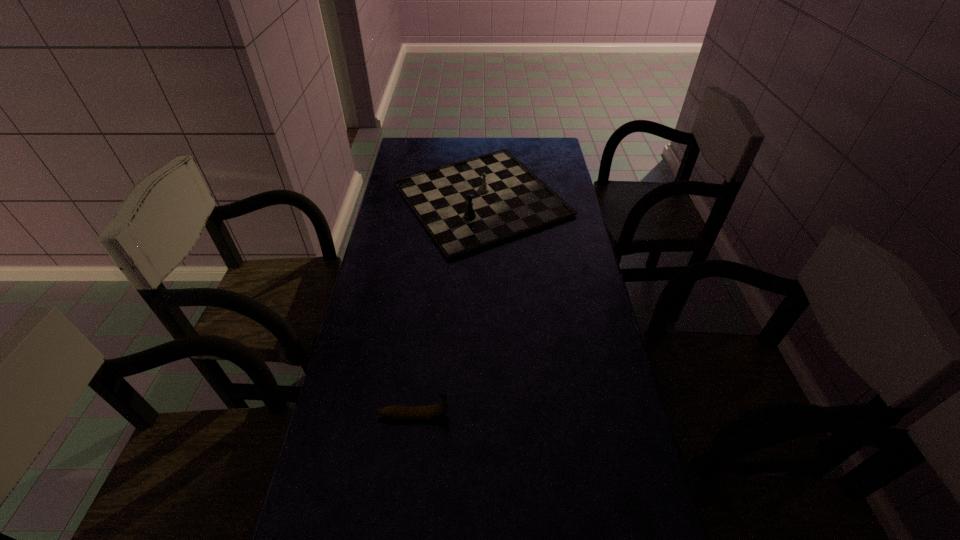
Locate an element on the screen. The height and width of the screenshot is (540, 960). the farther object is located at coordinates (467, 205).

Locate an element on the screen. The width and height of the screenshot is (960, 540). banana is located at coordinates (434, 411).

Locate an element on the screen. The width and height of the screenshot is (960, 540). vacant area situated 0.050m on the front of the farther object is located at coordinates (481, 271).

What are the coordinates of `free region located 0.400m at the stem of the nearer object` in the screenshot? It's located at (612, 415).

Find the location of a particular element. The height and width of the screenshot is (540, 960). object located at the far edge is located at coordinates (467, 205).

Image resolution: width=960 pixels, height=540 pixels. I want to click on gameboard that is at the left edge, so click(467, 205).

At what (x,y) coordinates should I click in order to perform the action: click on banana situated at the left edge. Please return your answer as a coordinate pair (x, y). This screenshot has width=960, height=540. Looking at the image, I should click on (434, 411).

Where is `object present at the right edge`? object present at the right edge is located at coordinates coord(467,205).

This screenshot has height=540, width=960. I want to click on object that is at the far left corner, so click(467, 205).

Find the location of a particular element. object present at the far right corner is located at coordinates (467, 205).